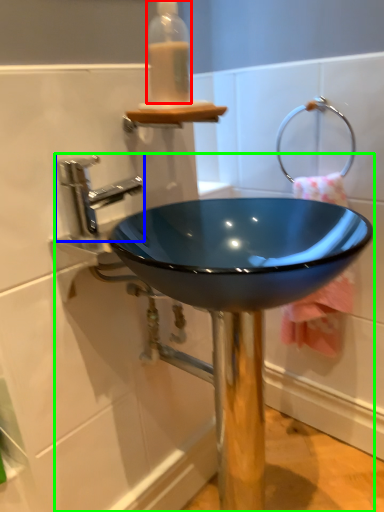
Question: Estimate the real-world distances between objects in this image. Which object is farther from bottle (highlighted by a red box), tap (highlighted by a blue box) or sink (highlighted by a green box)?

Choices:
 (A) tap
 (B) sink

Answer: (B)